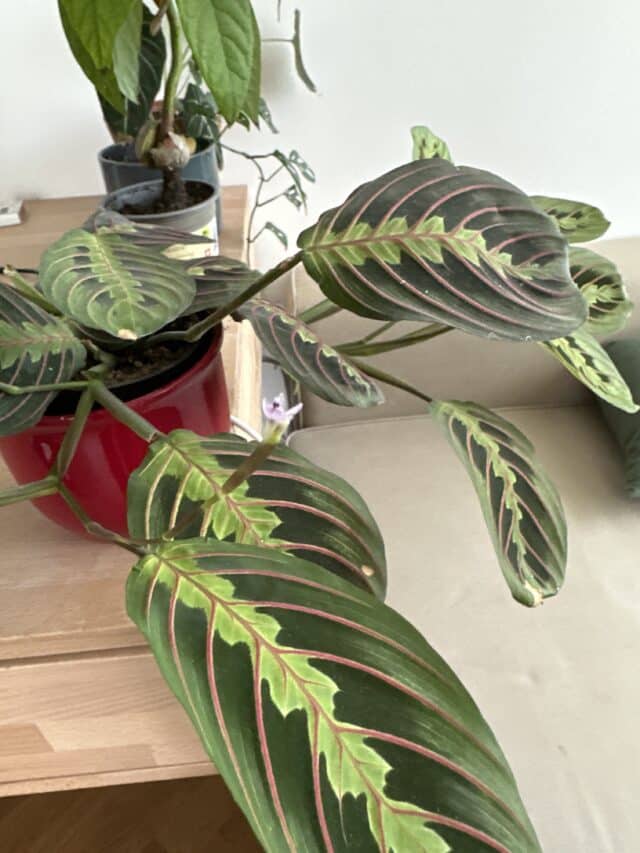
I want to click on pot, so click(108, 171), click(204, 212), click(132, 387), click(100, 459).